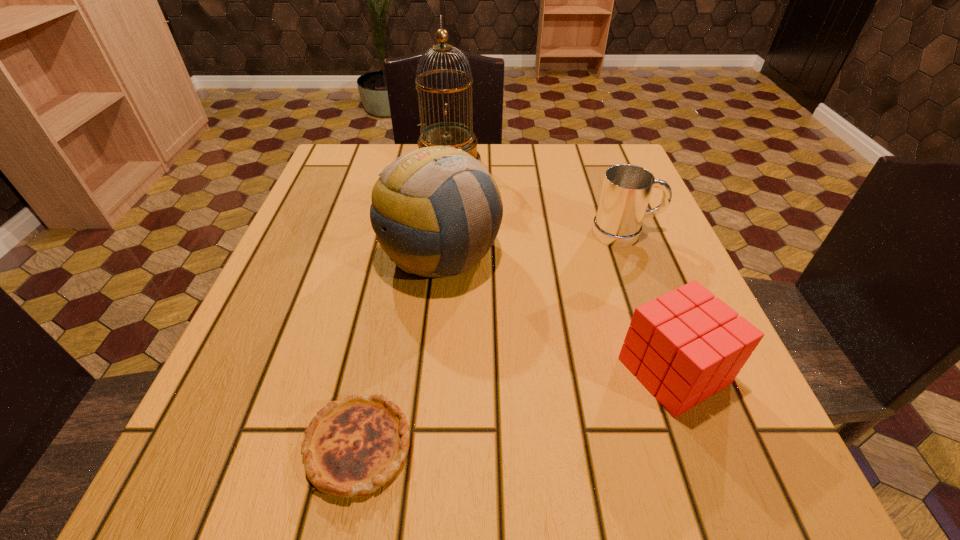
At what (x,y) coordinates should I click in order to perform the action: click on object located at the far edge. Please return your answer as a coordinate pair (x, y). The image size is (960, 540). Looking at the image, I should click on [x=460, y=136].

The height and width of the screenshot is (540, 960). I want to click on object present at the near edge, so click(x=351, y=448).

This screenshot has width=960, height=540. I want to click on object situated at the left edge, so click(x=351, y=448).

In order to click on mug located at the right edge in this screenshot , I will do `click(626, 191)`.

Image resolution: width=960 pixels, height=540 pixels. Find the location of `cube that is at the right edge`. cube that is at the right edge is located at coordinates (686, 345).

At what (x,y) coordinates should I click in order to perform the action: click on object that is at the near left corner. Please return your answer as a coordinate pair (x, y). This screenshot has width=960, height=540. Looking at the image, I should click on (351, 448).

The height and width of the screenshot is (540, 960). I want to click on free location at the far edge, so click(x=525, y=150).

This screenshot has width=960, height=540. In the image, there is a desktop. What are the coordinates of `vacant space at the left edge` in the screenshot? It's located at (349, 268).

I want to click on vacant space at the right edge, so click(610, 306).

The image size is (960, 540). Find the location of `vacant space at the far left corner of the desktop`. vacant space at the far left corner of the desktop is located at coordinates (365, 186).